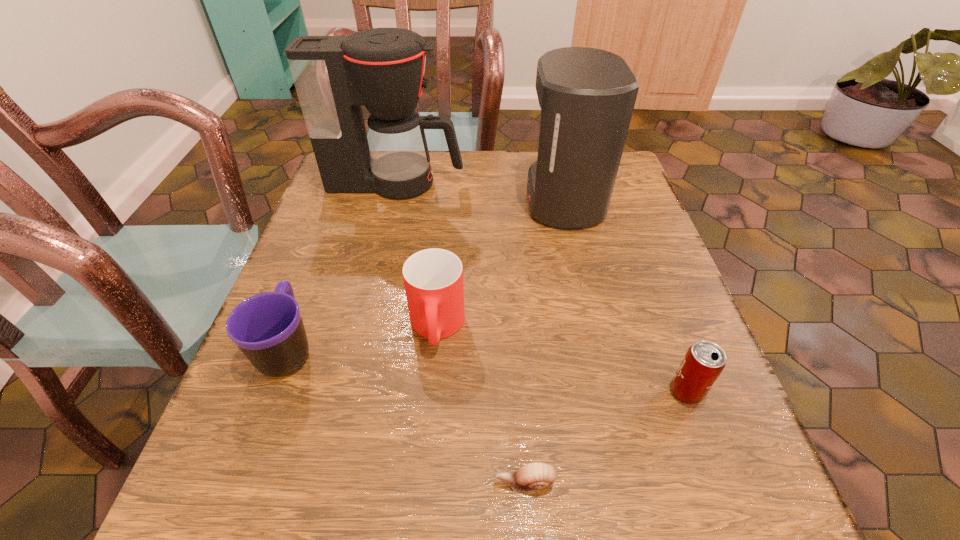
This screenshot has width=960, height=540. I want to click on the left coffee maker, so click(x=382, y=69).

Find the location of `the right coffee maker`. the right coffee maker is located at coordinates (587, 96).

Locate an element on the screen. cup is located at coordinates (433, 278).

At what (x,y) coordinates should I click in order to perform the action: click on mug. Please return your answer as a coordinate pair (x, y). Image resolution: width=960 pixels, height=540 pixels. Looking at the image, I should click on (267, 327).

You are a GUI agent. You are given a task and a screenshot of the screen. Output one action in this format:
    pyautogui.click(x=<x>, y=<y>)
    Task: Click on the rightmost object
    
    Given the screenshot: What is the action you would take?
    (704, 361)

Image resolution: width=960 pixels, height=540 pixels. Find the location of `the nearest object`. the nearest object is located at coordinates (534, 476).

You are a GUI agent. You are given a task and a screenshot of the screen. Output one action in this format:
    pyautogui.click(x=<x>, y=<y>)
    Task: Click on the escargot
    This screenshot has width=960, height=540.
    Given the screenshot: What is the action you would take?
    pyautogui.click(x=534, y=476)

Locate an element on the screen. This screenshot has height=540, width=960. vacant area situated pour from the carafe of the left coffee maker is located at coordinates (515, 183).

Identify the location of vacant space located on the button side of the right coffee maker. (372, 200).

Where is `vacant space located on the button side of the right coffee maker`? The height and width of the screenshot is (540, 960). vacant space located on the button side of the right coffee maker is located at coordinates (426, 200).